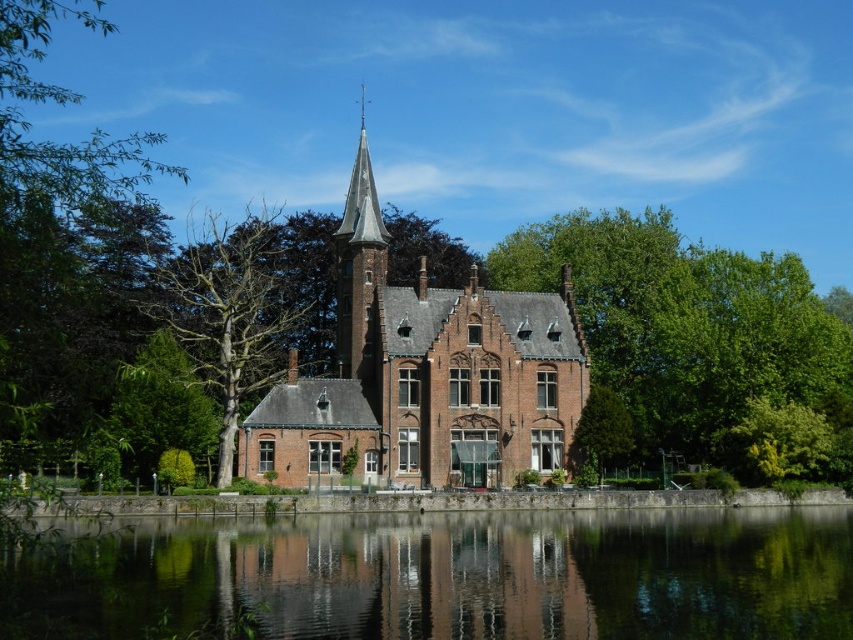
Is point (527, 333) positioned before point (364, 236)?

Yes, point (527, 333) is closer to viewer.

Is brick house at center bigger than smooth brick tower at center?

Correct, brick house at center is larger in size than smooth brick tower at center.

Image resolution: width=853 pixels, height=640 pixels. Identify the location of brick house at center. (422, 376).

Does transparent glass water at center appear under smooth brick tower at center?

Correct, transparent glass water at center is located below smooth brick tower at center.

Is point (276, 572) more distant than point (368, 269)?

No, (276, 572) is in front of (368, 269).

Is point (743, 609) positioned behind point (381, 252)?

That is False.

Find the location of a particular element. transparent glass water at center is located at coordinates coord(444,577).

Does point (540, 538) lie in front of point (575, 224)?

Yes, point (540, 538) is in front of point (575, 224).

Between transparent glass water at center and green leafy tree at right, which one appears on the left side from the viewer's perspective?

From the viewer's perspective, transparent glass water at center appears more on the left side.

Which is behind, point (543, 532) or point (744, 280)?

The point (744, 280) is behind.

In order to click on transparent glass water at center in this screenshot , I will do `click(444, 577)`.